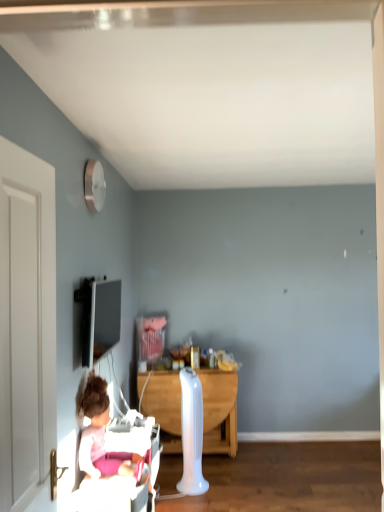
Question: Is matte black tv at upper left oriented towards white plastic radiator at center?

Choices:
 (A) yes
 (B) no

Answer: (B)

Question: Can you confirm if matte black tv at upper left is thinner than white plastic radiator at center?

Choices:
 (A) no
 (B) yes

Answer: (B)

Question: Is matte black tv at upper left not within white plastic radiator at center?

Choices:
 (A) no
 (B) yes

Answer: (B)

Question: Does matte black tv at upper left have a smaller size compared to white plastic radiator at center?

Choices:
 (A) no
 (B) yes

Answer: (B)

Question: Can you confirm if matte black tv at upper left is shorter than white plastic radiator at center?

Choices:
 (A) yes
 (B) no

Answer: (A)

Question: Considering the positions of white wooden door at left and wooden desk at center in the image, is white wooden door at left wider or thinner than wooden desk at center?

Choices:
 (A) thin
 (B) wide

Answer: (A)

Question: Is white wooden door at left inside the boundaries of wooden desk at center, or outside?

Choices:
 (A) outside
 (B) inside

Answer: (A)

Question: From their relative heights in the image, would you say white wooden door at left is taller or shorter than wooden desk at center?

Choices:
 (A) short
 (B) tall

Answer: (B)

Question: From the image's perspective, is white wooden door at left above or below wooden desk at center?

Choices:
 (A) above
 (B) below

Answer: (A)

Question: Is point (87, 342) closer or farther from the camera than point (34, 187)?

Choices:
 (A) closer
 (B) farther

Answer: (B)

Question: From the image's perspective, is matte black tv at upper left located above or below white wooden door at left?

Choices:
 (A) below
 (B) above

Answer: (A)

Question: Considering the positions of matte black tv at upper left and white wooden door at left in the image, is matte black tv at upper left taller or shorter than white wooden door at left?

Choices:
 (A) short
 (B) tall

Answer: (A)

Question: Is matte black tv at upper left in front of or behind white wooden door at left in the image?

Choices:
 (A) front
 (B) behind

Answer: (B)

Question: Is matte black tv at upper left in front of or behind wooden desk at center in the image?

Choices:
 (A) front
 (B) behind

Answer: (A)

Question: From the image's perspective, is matte black tv at upper left located above or below wooden desk at center?

Choices:
 (A) below
 (B) above

Answer: (B)